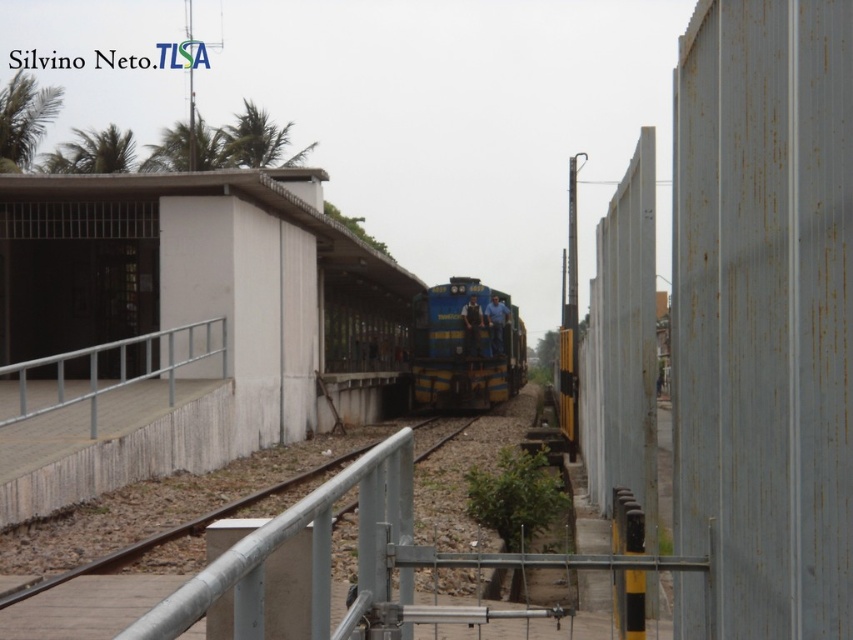
Question: Considering the real-world distances, which object is closest to the blue painted metal train at center?

Choices:
 (A) white concrete platform at left
 (B) silver metallic handrail at lower left

Answer: (A)

Question: Can you confirm if white concrete platform at left is positioned to the left of silver metallic handrail at lower left?

Choices:
 (A) no
 (B) yes

Answer: (A)

Question: Can you confirm if blue painted metal train at center is positioned below silver metallic handrail at lower left?

Choices:
 (A) no
 (B) yes

Answer: (B)

Question: Which of the following is the closest to the observer?

Choices:
 (A) (212, 465)
 (B) (434, 344)
 (C) (24, 406)

Answer: (C)

Question: Is white concrete platform at left to the right of blue painted metal train at center from the viewer's perspective?

Choices:
 (A) yes
 (B) no

Answer: (B)

Question: Which of these objects is positioned closest to the blue painted metal train at center?

Choices:
 (A) white concrete platform at left
 (B) silver metallic handrail at lower left

Answer: (A)